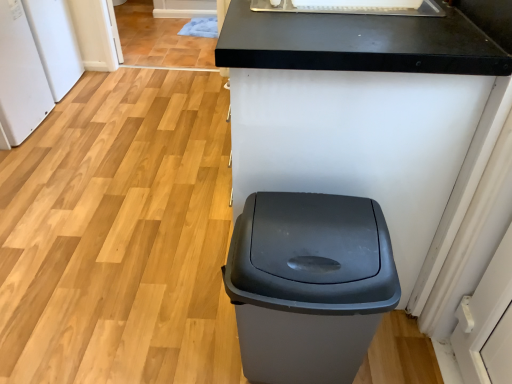
Measure the distance between white glossy sink at upper center and camera.

A distance of 1.06 meters exists between white glossy sink at upper center and camera.

The image size is (512, 384). I want to click on matte gray plastic trash can at center, so click(309, 284).

What's the angular difference between black matte counter at center and white glossy sink at upper center's facing directions?

The facing directions of black matte counter at center and white glossy sink at upper center are 0.629 degrees apart.

Considering the positions of point (419, 20) and point (298, 6), is point (419, 20) closer or farther from the camera than point (298, 6)?

Point (419, 20) is closer to the camera than point (298, 6).

Could white glossy sink at upper center be considered to be inside black matte counter at center?

Yes, white glossy sink at upper center is a part of black matte counter at center.

Considering the positions of objects black matte counter at center and white glossy sink at upper center in the image provided, who is more to the left, black matte counter at center or white glossy sink at upper center?

black matte counter at center.

Which object is positioned more to the right, black matte counter at center or matte gray plastic trash can at center?

black matte counter at center.

From a real-world perspective, is black matte counter at center above or below matte gray plastic trash can at center?

black matte counter at center is above matte gray plastic trash can at center.

Which object is thinner, black matte counter at center or matte gray plastic trash can at center?

matte gray plastic trash can at center.

In terms of height, does black matte counter at center look taller or shorter compared to matte gray plastic trash can at center?

Considering their sizes, black matte counter at center has more height than matte gray plastic trash can at center.

Is white matte refrigerator at left, acting as the 2th appliance starting from the back, situated inside black matte counter at center or outside?

white matte refrigerator at left, acting as the 2th appliance starting from the back, cannot be found inside black matte counter at center.

From a real-world perspective, which is physically below, white matte refrigerator at left, arranged as the first appliance when viewed from the front, or black matte counter at center?

From a 3D spatial view, white matte refrigerator at left, arranged as the first appliance when viewed from the front, is below.

Between point (27, 68) and point (247, 47), which one is positioned in front?

Positioned in front is point (247, 47).

From the image's perspective, which appliance is the 1st one above the black matte counter at center? Please provide its 2D coordinates.

[(20, 76)]

Is black matte counter at center at the back of white glossy sink at upper center?

That's right, white glossy sink at upper center is facing away from black matte counter at center.

From a real-world perspective, which object rests below the other?

black matte counter at center, from a real-world perspective.

From the image's perspective, is white glossy sink at upper center located above or below black matte counter at center?

white glossy sink at upper center is above black matte counter at center.

This screenshot has width=512, height=384. What are the coordinates of `counter in front of the white matte refrigerator at left, arranged as the first appliance when viewed from the front` in the screenshot? It's located at (371, 114).

Is black matte counter at center to the right of white matte refrigerator at left, acting as the 2th appliance starting from the back, from the viewer's perspective?

Yes.

From a real-world perspective, relative to white matte refrigerator at left, arranged as the first appliance when viewed from the front, is black matte counter at center vertically above or below?

black matte counter at center is above white matte refrigerator at left, arranged as the first appliance when viewed from the front.

Measure the distance between black matte counter at center and white matte refrigerator at left, acting as the 2th appliance starting from the back.

6.03 feet.

From the image's perspective, is white glossy sink at upper center beneath white matte refrigerator at left, arranged as the first appliance when viewed from the front?

Yes.

Which object is closer to the camera, white glossy sink at upper center or white matte refrigerator at left, arranged as the first appliance when viewed from the front?

white glossy sink at upper center.

Between white glossy sink at upper center and white matte refrigerator at left, arranged as the first appliance when viewed from the front, which one has smaller width?

With smaller width is white matte refrigerator at left, arranged as the first appliance when viewed from the front.

Would you say white glossy sink at upper center is a long distance from white matte refrigerator at left, acting as the 2th appliance starting from the back?

Absolutely, white glossy sink at upper center is distant from white matte refrigerator at left, acting as the 2th appliance starting from the back.

Can you tell me how much white matte refrigerator at left, which ranks as the 2th appliance in front-to-back order, and white matte refrigerator at left, acting as the 2th appliance starting from the back, differ in facing direction?

The angular difference between white matte refrigerator at left, which ranks as the 2th appliance in front-to-back order, and white matte refrigerator at left, acting as the 2th appliance starting from the back, is 0.000786 degrees.

Is white matte refrigerator at left, which appears as the first appliance when viewed from the back, spatially inside white matte refrigerator at left, acting as the 2th appliance starting from the back, or outside of it?

white matte refrigerator at left, which appears as the first appliance when viewed from the back, is located beyond the bounds of white matte refrigerator at left, acting as the 2th appliance starting from the back.

Is white matte refrigerator at left, arranged as the first appliance when viewed from the front, at the back of white matte refrigerator at left, which appears as the first appliance when viewed from the back?

That's not correct — white matte refrigerator at left, which appears as the first appliance when viewed from the back, is not looking away from white matte refrigerator at left, arranged as the first appliance when viewed from the front.

Is point (78, 58) farther from camera compared to point (19, 52)?

Yes, point (78, 58) is behind point (19, 52).

This screenshot has height=384, width=512. In order to click on sink that appears behind the black matte counter at center in this screenshot , I will do `click(350, 9)`.

Locate an element on the screen. waste container in front of the black matte counter at center is located at coordinates (309, 284).

Based on their spatial positions, is white matte refrigerator at left, arranged as the first appliance when viewed from the front, or white matte refrigerator at left, which appears as the first appliance when viewed from the back, closer to white glossy sink at upper center?

white matte refrigerator at left, arranged as the first appliance when viewed from the front, lies closer to white glossy sink at upper center than the other object.

From the picture: Looking at the image, which one is located further to white glossy sink at upper center, matte gray plastic trash can at center or white matte refrigerator at left, acting as the 2th appliance starting from the back?

Result: white matte refrigerator at left, acting as the 2th appliance starting from the back, is positioned further to the anchor white glossy sink at upper center.

Considering their positions, is white glossy sink at upper center positioned closer to matte gray plastic trash can at center than white matte refrigerator at left, which appears as the first appliance when viewed from the back?

white glossy sink at upper center.

Looking at this image, estimate the real-world distances between objects in this image. Which object is further from white matte refrigerator at left, acting as the 2th appliance starting from the back, matte gray plastic trash can at center or white glossy sink at upper center?

matte gray plastic trash can at center.

Estimate the real-world distances between objects in this image. Which object is further from matte gray plastic trash can at center, white matte refrigerator at left, which appears as the first appliance when viewed from the back, or black matte counter at center?

Based on the image, white matte refrigerator at left, which appears as the first appliance when viewed from the back, appears to be further to matte gray plastic trash can at center.

Estimate the real-world distances between objects in this image. Which object is further from matte gray plastic trash can at center, white matte refrigerator at left, acting as the 2th appliance starting from the back, or black matte counter at center?

white matte refrigerator at left, acting as the 2th appliance starting from the back, lies further to matte gray plastic trash can at center than the other object.

Looking at the image, which one is located further to white matte refrigerator at left, which ranks as the 2th appliance in front-to-back order, white matte refrigerator at left, arranged as the first appliance when viewed from the front, or matte gray plastic trash can at center?

matte gray plastic trash can at center.

Based on their spatial positions, is white matte refrigerator at left, which ranks as the 2th appliance in front-to-back order, or black matte counter at center further from white glossy sink at upper center?

Based on the image, white matte refrigerator at left, which ranks as the 2th appliance in front-to-back order, appears to be further to white glossy sink at upper center.

Identify the location of waste container between white matte refrigerator at left, which ranks as the 2th appliance in front-to-back order, and black matte counter at center, in the horizontal direction. (309, 284).

Where is `appliance between white matte refrigerator at left, arranged as the first appliance when viewed from the front, and white glossy sink at upper center`? The image size is (512, 384). appliance between white matte refrigerator at left, arranged as the first appliance when viewed from the front, and white glossy sink at upper center is located at coordinates point(55,44).

Where is `appliance located between white matte refrigerator at left, acting as the 2th appliance starting from the back, and black matte counter at center in the left-right direction`? appliance located between white matte refrigerator at left, acting as the 2th appliance starting from the back, and black matte counter at center in the left-right direction is located at coordinates (55, 44).

This screenshot has height=384, width=512. I want to click on waste container located between white matte refrigerator at left, acting as the 2th appliance starting from the back, and black matte counter at center in the left-right direction, so click(x=309, y=284).